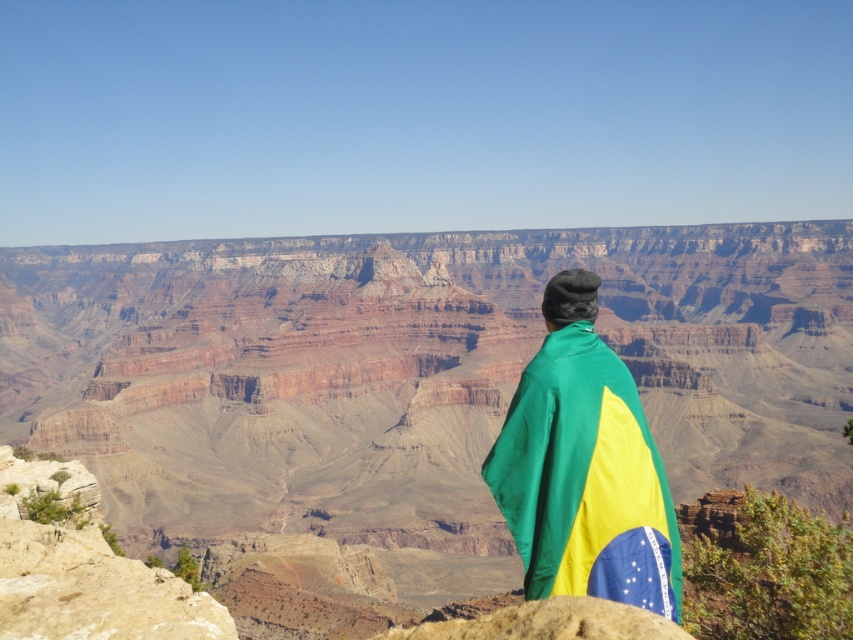
You are standing at the edge of the Grand Canyon and see two points marked in the scene. The first point is located at coordinates point (724, 241) and the second at point (596, 346). Which of these points is closer to your current position?

Point (724, 241) is closer to your current position because it is further to the camera than point (596, 346), meaning it is nearer to the observer standing at the edge.